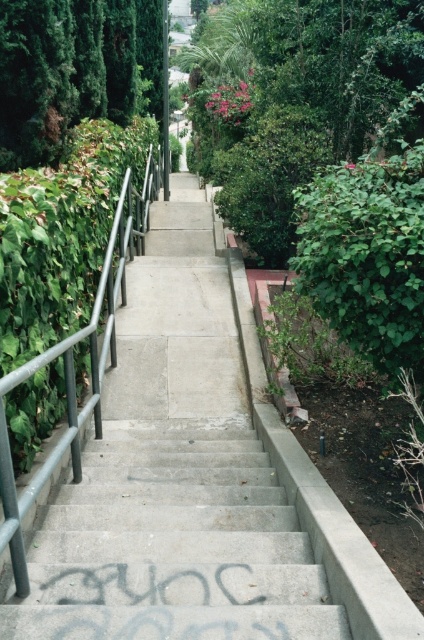
You are a person standing at the bottom of the concrete stairs at center. You want to reach the top of the stairs while avoiding the metallic gray railing at center. Which direction should you move towards?

The concrete stairs at center is located below the metallic gray railing at center, so to avoid the railing, you should move towards the right side of the stairs where there is a low brick wall and vegetation instead of the railing on the left side.

You are a painter who needs to assess the area to paint both the concrete stairs at center and the metallic gray railing at center. Based on the scene, which object requires more paint in terms of surface area?

The metallic gray railing at center requires more paint because it occupies more space than the concrete stairs at center, as stated in the objects description.